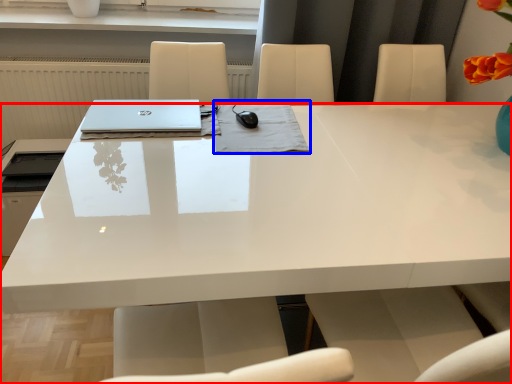
Question: Which of the following is the farthest to the observer, desk (highlighted by a red box) or notebook (highlighted by a blue box)?

Choices:
 (A) desk
 (B) notebook

Answer: (B)